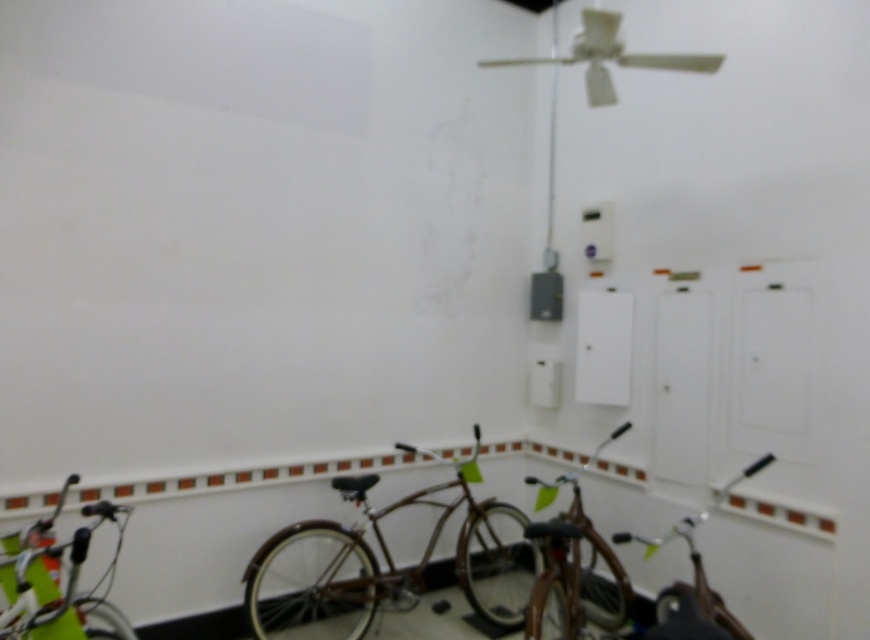
Does point (296, 561) come farther from viewer compared to point (75, 637)?

Yes, it is.

Who is lower down, brown matte bicycle at center or white glossy bicycle at lower left?

brown matte bicycle at center

Is point (502, 522) more distant than point (91, 609)?

Yes, point (502, 522) is behind point (91, 609).

Identify the location of brown matte bicycle at center. This screenshot has width=870, height=640. (386, 563).

Is brown matte bicycle at center bigger than shiny brown bicycle at lower right?

Yes.

Is brown matte bicycle at center thinner than shiny brown bicycle at lower right?

No.

Locate an element on the screen. The width and height of the screenshot is (870, 640). brown matte bicycle at center is located at coordinates (386, 563).

Locate an element on the screen. brown matte bicycle at center is located at coordinates click(386, 563).

Can you confirm if shiny brown bicycle at center is positioned below shiny brown bicycle at lower right?

Yes.

Is shiny brown bicycle at center closer to camera compared to shiny brown bicycle at lower right?

No.

This screenshot has width=870, height=640. What do you see at coordinates (573, 570) in the screenshot? I see `shiny brown bicycle at center` at bounding box center [573, 570].

You are a GUI agent. You are given a task and a screenshot of the screen. Output one action in this format:
    pyautogui.click(x=<x>, y=<y>)
    Task: Click on the shiny brown bicycle at center
    
    Given the screenshot: What is the action you would take?
    pyautogui.click(x=573, y=570)